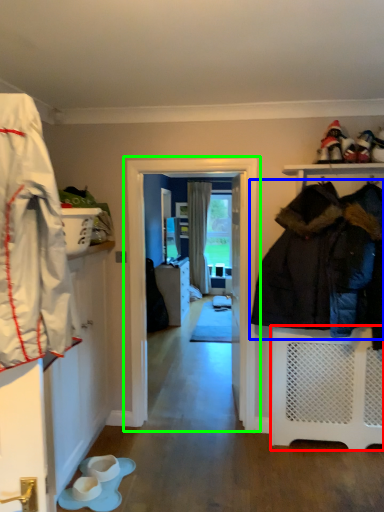
Question: Which object is positioned farthest from shelf (highlighted by a red box)? Select from jacket (highlighted by a blue box) and screen door (highlighted by a green box).

Choices:
 (A) jacket
 (B) screen door

Answer: (B)